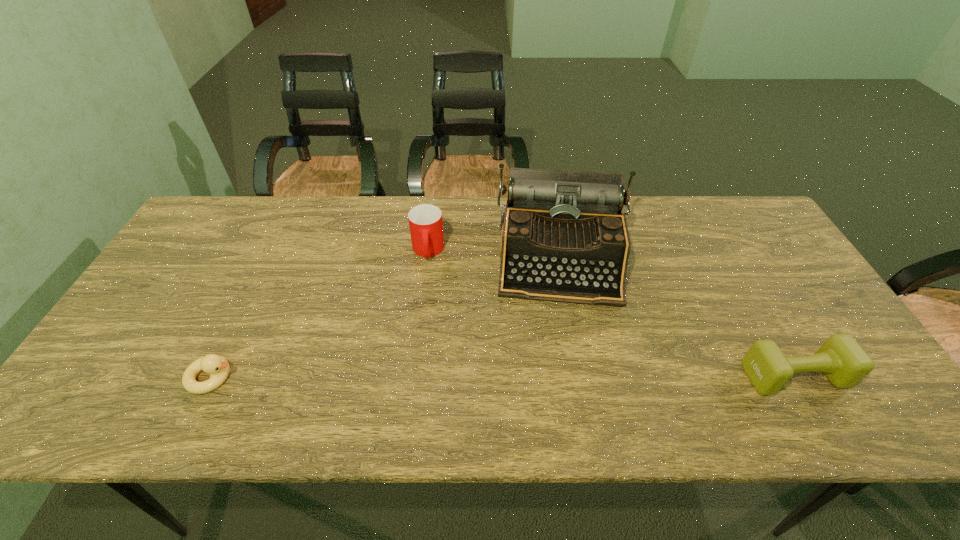
I want to click on vacant area in the image that satisfies the following two spatial constraints: 1. on the front side of the third tallest object; 2. on the right side of the cup, so click(413, 376).